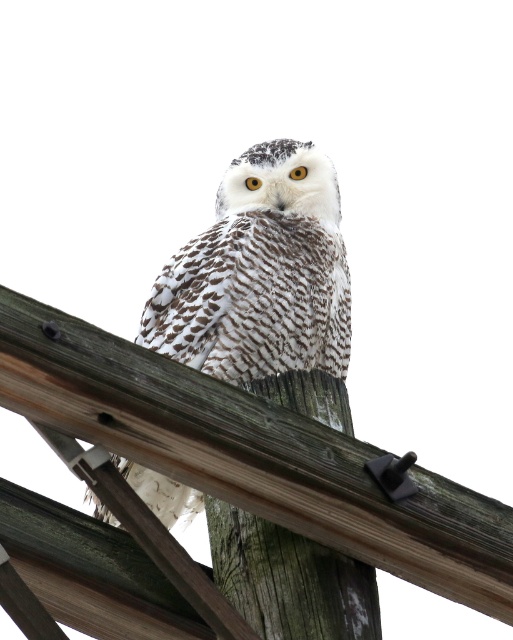
Can you confirm if white speckled owl at center is positioned to the left of wooden at center?

Yes, white speckled owl at center is to the left of wooden at center.

Which is in front, point (161, 316) or point (128, 424)?

Positioned in front is point (128, 424).

Which is behind, point (253, 268) or point (255, 438)?

Positioned behind is point (253, 268).

Identify the location of white speckled owl at center. (260, 275).